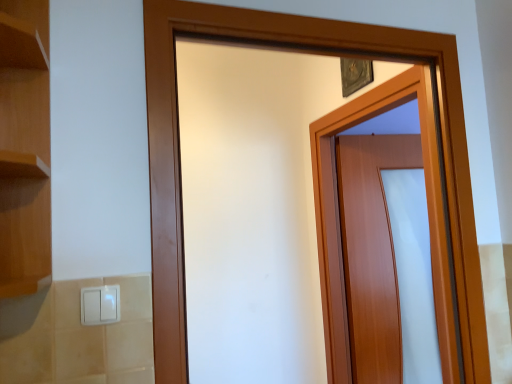
Question: Would you say white plastic light switch at lower left is inside or outside wooden door at center, arranged as the 2th door when viewed from the front?

Choices:
 (A) outside
 (B) inside

Answer: (A)

Question: Looking at their shapes, would you say white plastic light switch at lower left is wider or thinner than wooden door at center, arranged as the 2th door when viewed from the front?

Choices:
 (A) thin
 (B) wide

Answer: (A)

Question: Estimate the real-world distances between objects in this image. Which object is closer to the white plastic light switch at lower left?

Choices:
 (A) wooden door at center, placed as the second door when sorted from back to front
 (B) wooden door at center, arranged as the 2th door when viewed from the front

Answer: (A)

Question: Which of these objects is positioned farthest from the wooden door at center, arranged as the 2th door when viewed from the front?

Choices:
 (A) white plastic light switch at lower left
 (B) wooden door at center, placed as the second door when sorted from back to front

Answer: (A)